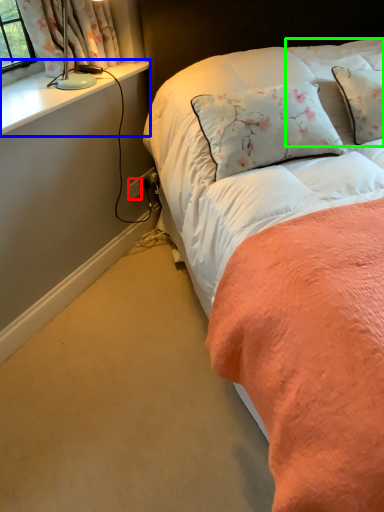
Question: Which object is positioned farthest from power outlet (highlighted by a red box)? Select from window sill (highlighted by a blue box) and pillow (highlighted by a green box).

Choices:
 (A) window sill
 (B) pillow

Answer: (B)